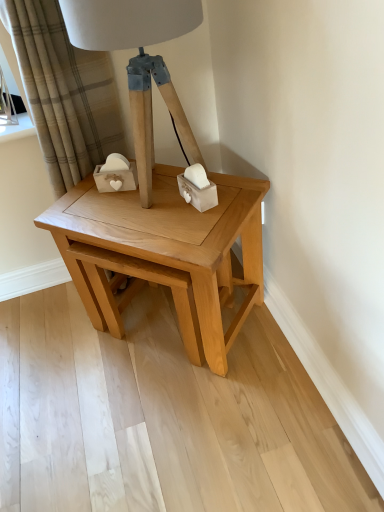
The height and width of the screenshot is (512, 384). In order to click on empty space that is ontop of natural wood table at center (from a real-world perspective) in this screenshot , I will do `click(156, 207)`.